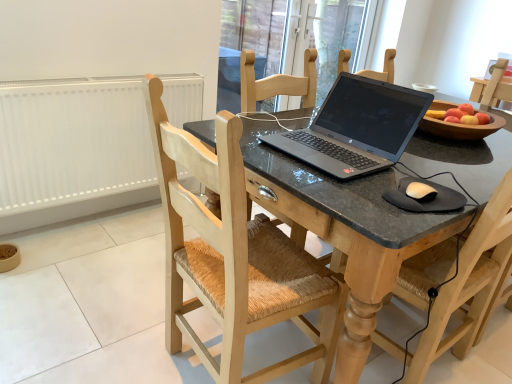
The image size is (512, 384). Identify the location of blank space to the left of white matte mouse at lower right. (354, 191).